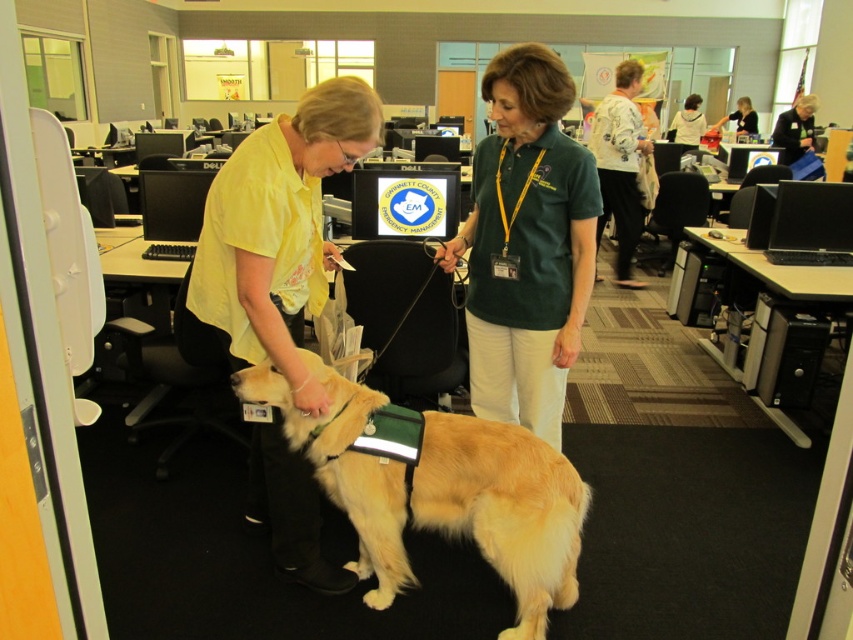
You are standing in the office and want to determine which of the two points, point (637, 68) or point (792, 124), is closer to you. Based on the scene description, which point is nearer?

Point (637, 68) is closer to the viewer than point (792, 124).